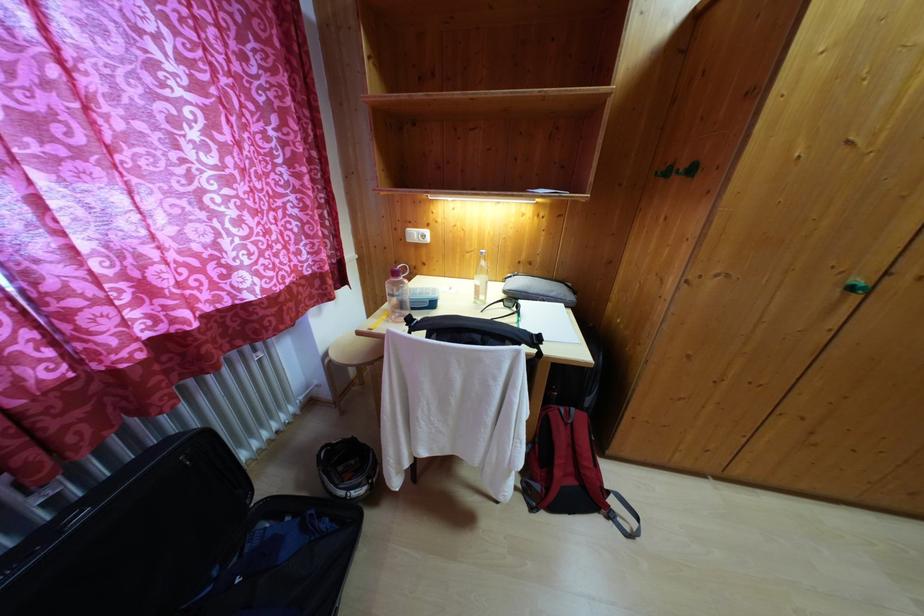
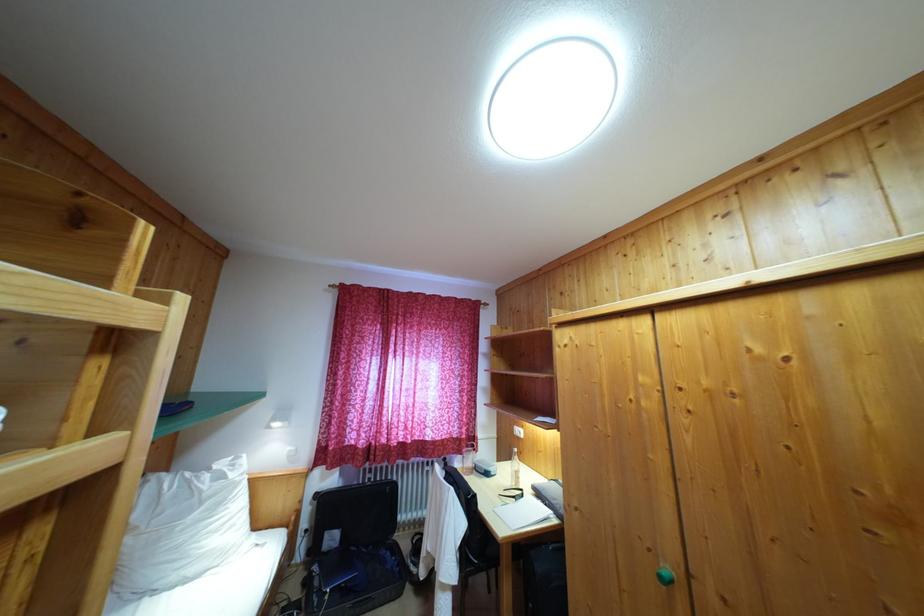
Question: I am providing you with two images of the same scene from different viewpoints. Which of the following objects are not visible in image2?

Choices:
 (A) white power outlet
 (B) green cabinet knob
 (C) red and white bottle
 (D) wooden ladder rung

Answer: (A)